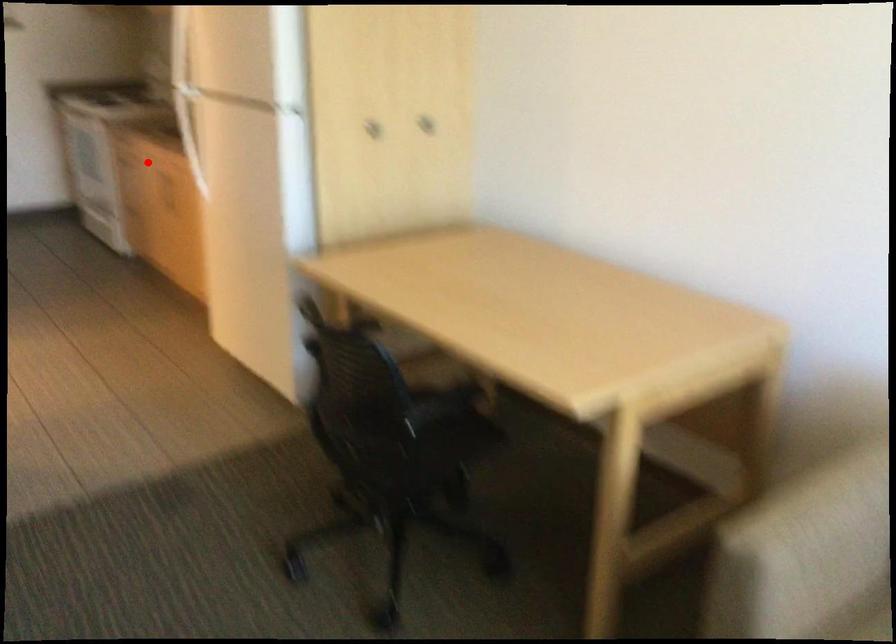
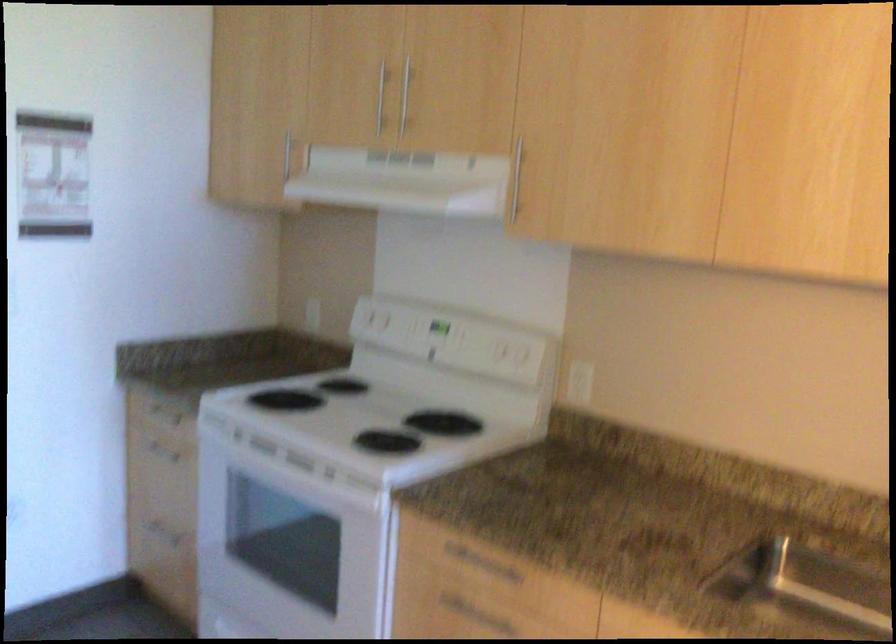
In the second image, find the point that corresponds to the highlighted location in the first image.

(466, 609)